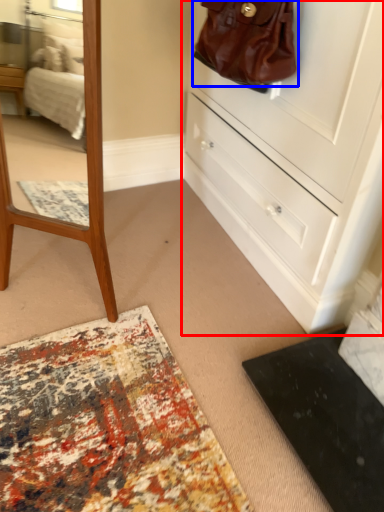
Question: Among these objects, which one is nearest to the camera, chest of drawers (highlighted by a red box) or handbag (highlighted by a blue box)?

Choices:
 (A) chest of drawers
 (B) handbag

Answer: (A)